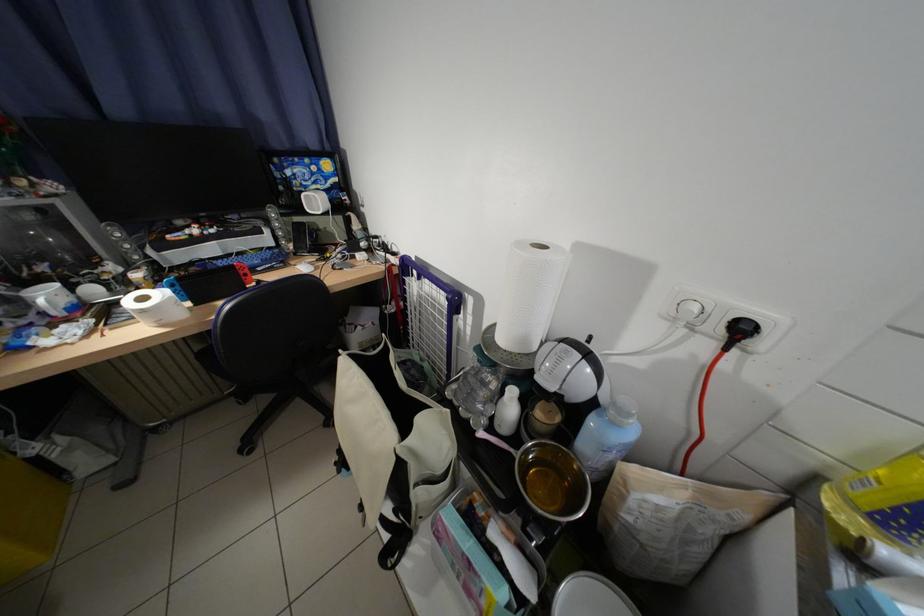
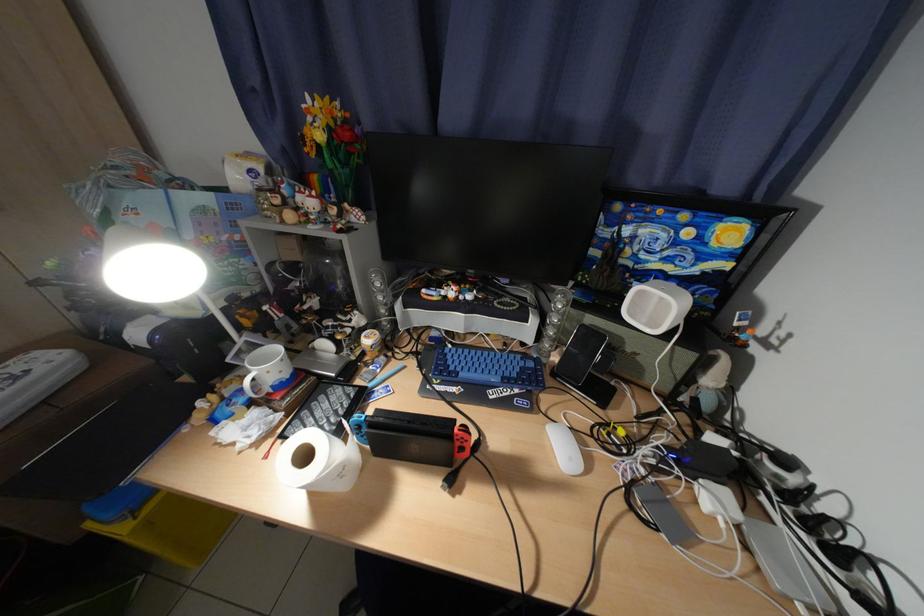
The point at (110, 336) is marked in the first image. Where is the corresponding point in the second image?

(282, 444)